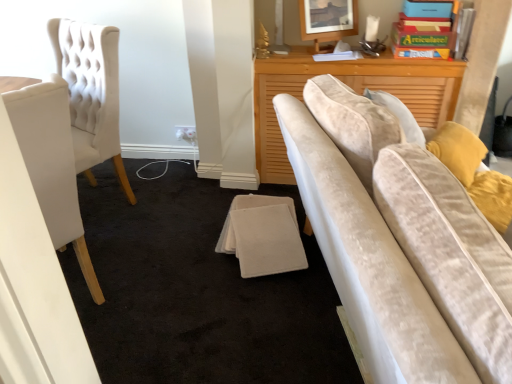
What is the approximate height of wooden picture frame at upper center?

25.67 centimeters.

What do you see at coordinates (328, 19) in the screenshot?
I see `wooden picture frame at upper center` at bounding box center [328, 19].

In order to click on wooden picture frame at upper center in this screenshot , I will do click(x=328, y=19).

In order to face wooden picture frame at upper center, should I rotate leftwards or rightwards?

Rotate right and turn 9.477 degrees.

Where is `white fabric chair at left`? white fabric chair at left is located at coordinates (50, 161).

Image resolution: width=512 pixels, height=384 pixels. Describe the element at coordinates (50, 161) in the screenshot. I see `white fabric chair at left` at that location.

Image resolution: width=512 pixels, height=384 pixels. Identify the location of wooden picture frame at upper center. (328, 19).

Can you confirm if wooden picture frame at upper center is positioned to the left of white fabric chair at left?

In fact, wooden picture frame at upper center is to the right of white fabric chair at left.

Between wooden picture frame at upper center and white fabric chair at left, which one is positioned in front?

white fabric chair at left.

Is point (335, 2) farther from camera compared to point (31, 157)?

Yes, point (335, 2) is farther from viewer.

From the image's perspective, which is below, wooden picture frame at upper center or white fabric chair at left?

white fabric chair at left appears lower in the image.

From a real-world perspective, which object rests below the other?

white fabric chair at left.

Considering the relative sizes of wooden picture frame at upper center and white fabric chair at left in the image provided, is wooden picture frame at upper center thinner than white fabric chair at left?

Indeed, wooden picture frame at upper center has a lesser width compared to white fabric chair at left.

From their relative heights in the image, would you say wooden picture frame at upper center is taller or shorter than white fabric chair at left?

wooden picture frame at upper center is shorter than white fabric chair at left.

Considering the sizes of wooden picture frame at upper center and white fabric chair at left in the image, is wooden picture frame at upper center bigger or smaller than white fabric chair at left?

Considering their sizes, wooden picture frame at upper center takes up less space than white fabric chair at left.

Would you say wooden picture frame at upper center is outside white fabric chair at left?

Yes.

Would you say wooden picture frame at upper center is a long distance from white fabric chair at left?

That's right, there is a large distance between wooden picture frame at upper center and white fabric chair at left.

Is wooden picture frame at upper center oriented towards white fabric chair at left?

No, wooden picture frame at upper center is not turned towards white fabric chair at left.

Locate an element on the screen. The width and height of the screenshot is (512, 384). picture frame above the white fabric chair at left (from the image's perspective) is located at coordinates (328, 19).

Considering the positions of objects white fabric chair at left and wooden picture frame at upper center in the image provided, who is more to the left, white fabric chair at left or wooden picture frame at upper center?

From the viewer's perspective, white fabric chair at left appears more on the left side.

Is the depth of white fabric chair at left greater than that of wooden picture frame at upper center?

That is False.

Is point (63, 219) closer or farther from the camera than point (307, 5)?

Point (63, 219) appears to be closer to the viewer than point (307, 5).

From the image's perspective, which object appears higher, white fabric chair at left or wooden picture frame at upper center?

wooden picture frame at upper center is shown above in the image.

From a real-world perspective, is white fabric chair at left below wooden picture frame at upper center?

Yes, from a real-world perspective, white fabric chair at left is beneath wooden picture frame at upper center.

Considering the sizes of white fabric chair at left and wooden picture frame at upper center in the image, is white fabric chair at left wider or thinner than wooden picture frame at upper center?

Considering their sizes, white fabric chair at left looks broader than wooden picture frame at upper center.

Can you confirm if white fabric chair at left is taller than wooden picture frame at upper center?

Correct, white fabric chair at left is much taller as wooden picture frame at upper center.

Is white fabric chair at left smaller than wooden picture frame at upper center?

Incorrect, white fabric chair at left is not smaller in size than wooden picture frame at upper center.

Is white fabric chair at left outside of wooden picture frame at upper center?

white fabric chair at left lies outside wooden picture frame at upper center's area.

Does white fabric chair at left touch wooden picture frame at upper center?

There is a gap between white fabric chair at left and wooden picture frame at upper center.

Is white fabric chair at left facing towards wooden picture frame at upper center?

No, white fabric chair at left is not oriented towards wooden picture frame at upper center.

How different are the orientations of white fabric chair at left and wooden picture frame at upper center in degrees?

150 degrees.

Find the location of a particular element. Image resolution: width=512 pixels, height=384 pixels. picture frame on the right of white fabric chair at left is located at coordinates (328, 19).

This screenshot has height=384, width=512. Identify the location of chair below the wooden picture frame at upper center (from a real-world perspective). pos(50,161).

Find the location of `picture frame behind the white fabric chair at left`. picture frame behind the white fabric chair at left is located at coordinates (328, 19).